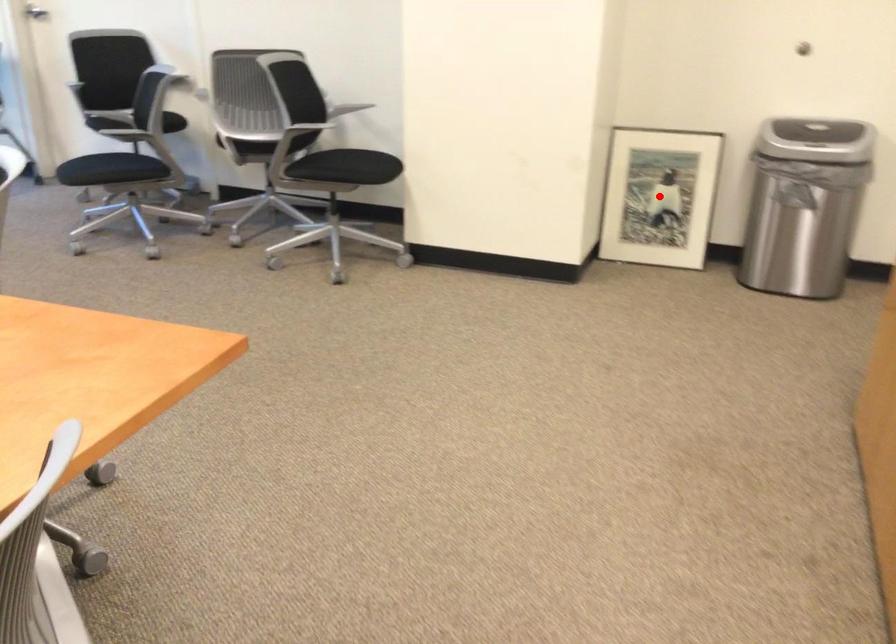
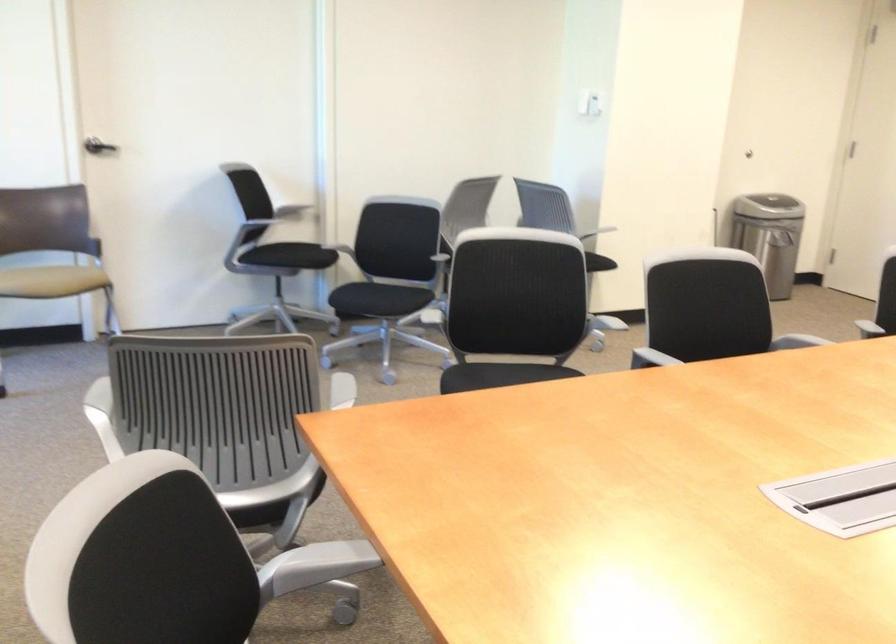
Question: I am providing you with two images of the same scene from different viewpoints. A red point is marked on the first image. Is the red point's position out of view in image 2?

Choices:
 (A) Yes
 (B) No

Answer: (A)